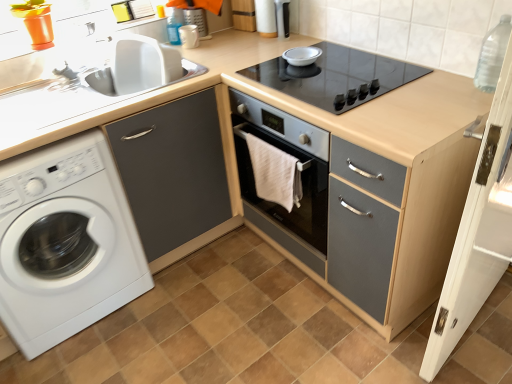
At what (x,y) coordinates should I click in order to perform the action: click on free space below white wood screen door at right (from a real-world perspective). Please return your answer as a coordinate pair (x, y). This screenshot has height=384, width=512. Looking at the image, I should click on (x=480, y=332).